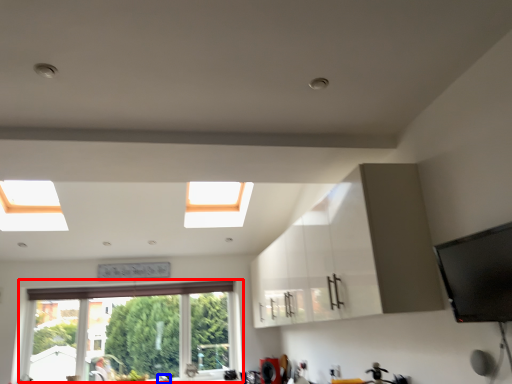
Question: Which point is further to the camera, window (highlighted by a red box) or faucet (highlighted by a blue box)?

Choices:
 (A) window
 (B) faucet

Answer: (A)